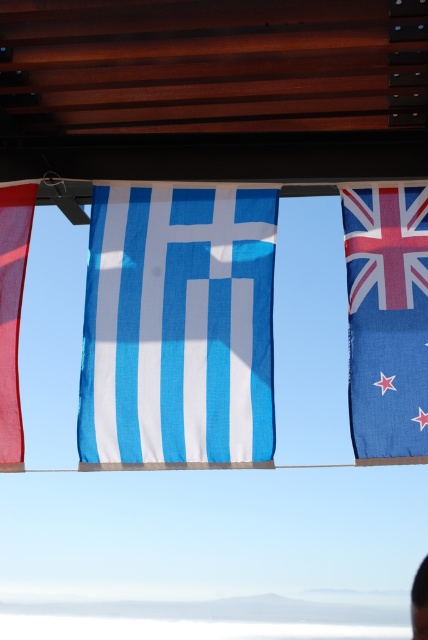
Where is `blue fabric flag at center`? The height and width of the screenshot is (640, 428). blue fabric flag at center is located at coordinates (178, 328).

Between blue fabric flag at center and matte red flag at left, which one appears on the left side from the viewer's perspective?

From the viewer's perspective, matte red flag at left appears more on the left side.

Is point (148, 374) positioned behind point (0, 385)?

Yes, point (148, 374) is farther from viewer.

Find the location of a particular element. The width and height of the screenshot is (428, 640). blue fabric flag at center is located at coordinates (178, 328).

Consider the image. Who is more forward, (386, 392) or (14, 228)?

Point (386, 392) is in front.

Does point (395, 220) come in front of point (24, 220)?

Yes.

The width and height of the screenshot is (428, 640). Find the location of `blue fabric flag at right`. blue fabric flag at right is located at coordinates (386, 321).

Is blue fabric flag at center below black plastic person at lower right?

No, blue fabric flag at center is not below black plastic person at lower right.

Between blue fabric flag at center and black plastic person at lower right, which one appears on the left side from the viewer's perspective?

blue fabric flag at center is more to the left.

Which is in front, point (205, 202) or point (422, 593)?

Point (422, 593)

You are a GUI agent. You are given a task and a screenshot of the screen. Output one action in this format:
    pyautogui.click(x=<x>, y=<y>)
    Task: Click on the blue fabric flag at center
    This screenshot has height=640, width=428.
    Given the screenshot: What is the action you would take?
    pyautogui.click(x=178, y=328)